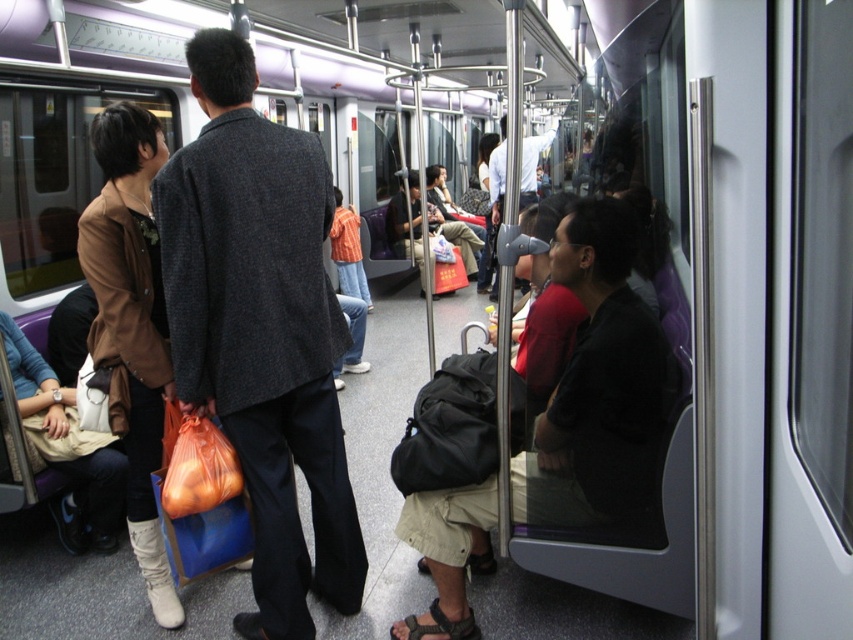
Which is more to the right, leather boots at lower left or dark gray suit at center?

dark gray suit at center

Does point (143, 182) come in front of point (497, 163)?

Yes, it is.

This screenshot has width=853, height=640. Identify the location of leather boots at lower left. (131, 324).

Does dark gray backpack at center have a lesser width compared to dark gray suit at center?

In fact, dark gray backpack at center might be wider than dark gray suit at center.

Which of these two, dark gray backpack at center or dark gray suit at center, stands taller?

Standing taller between the two is dark gray backpack at center.

Which is behind, point (624, 218) or point (532, 173)?

The point (532, 173) is behind.

Identify the location of dark gray backpack at center. click(598, 385).

Does beige fabric bag at lower left have a larger size compared to dark gray suit at center?

No.

Does point (68, 445) come behind point (525, 138)?

No, it is not.

Is point (115, 481) farther from camera compared to point (527, 166)?

That is False.

I want to click on beige fabric bag at lower left, so click(68, 448).